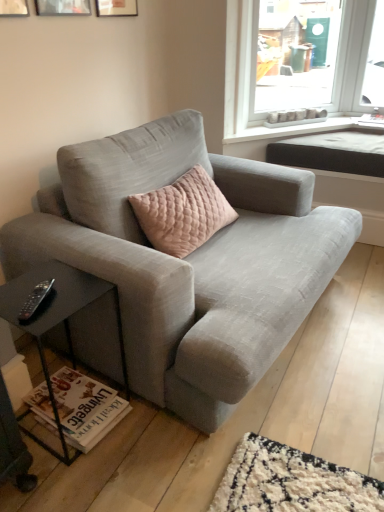
Question: Should I look upward or downward to see black plastic remote at lower left?

Choices:
 (A) down
 (B) up

Answer: (A)

Question: Is matte wooden picture frame at upper center, the first picture frame viewed from the right, taller than black plastic remote at lower left?

Choices:
 (A) yes
 (B) no

Answer: (A)

Question: Considering the relative sizes of matte wooden picture frame at upper center, the 3th picture frame positioned from the left, and black plastic remote at lower left in the image provided, is matte wooden picture frame at upper center, the 3th picture frame positioned from the left, smaller than black plastic remote at lower left?

Choices:
 (A) no
 (B) yes

Answer: (A)

Question: Is matte wooden picture frame at upper center, the 3th picture frame positioned from the left, thinner than black plastic remote at lower left?

Choices:
 (A) no
 (B) yes

Answer: (B)

Question: Is matte wooden picture frame at upper center, the 3th picture frame positioned from the left, at the right side of black plastic remote at lower left?

Choices:
 (A) no
 (B) yes

Answer: (B)

Question: Can you confirm if matte wooden picture frame at upper center, the first picture frame viewed from the right, is wider than black plastic remote at lower left?

Choices:
 (A) yes
 (B) no

Answer: (B)

Question: Is matte wooden picture frame at upper center, the 3th picture frame positioned from the left, looking in the opposite direction of black plastic remote at lower left?

Choices:
 (A) no
 (B) yes

Answer: (A)

Question: From a real-world perspective, is metallic silver picture frame at upper left, which is the 2th picture frame from left to right, on top of black plastic remote at lower left?

Choices:
 (A) yes
 (B) no

Answer: (A)

Question: From the image's perspective, is metallic silver picture frame at upper left, placed as the 2th picture frame when sorted from right to left, beneath black plastic remote at lower left?

Choices:
 (A) no
 (B) yes

Answer: (A)

Question: Is metallic silver picture frame at upper left, placed as the 2th picture frame when sorted from right to left, turned away from black plastic remote at lower left?

Choices:
 (A) no
 (B) yes

Answer: (A)

Question: Is metallic silver picture frame at upper left, placed as the 2th picture frame when sorted from right to left, to the left of black plastic remote at lower left from the viewer's perspective?

Choices:
 (A) no
 (B) yes

Answer: (B)

Question: Does metallic silver picture frame at upper left, placed as the 2th picture frame when sorted from right to left, have a lesser height compared to black plastic remote at lower left?

Choices:
 (A) yes
 (B) no

Answer: (B)

Question: Considering the relative sizes of metallic silver picture frame at upper left, placed as the 2th picture frame when sorted from right to left, and black plastic remote at lower left in the image provided, is metallic silver picture frame at upper left, placed as the 2th picture frame when sorted from right to left, thinner than black plastic remote at lower left?

Choices:
 (A) yes
 (B) no

Answer: (A)

Question: Is textured gray couch at center positioned behind black plastic remote at lower left?

Choices:
 (A) no
 (B) yes

Answer: (A)